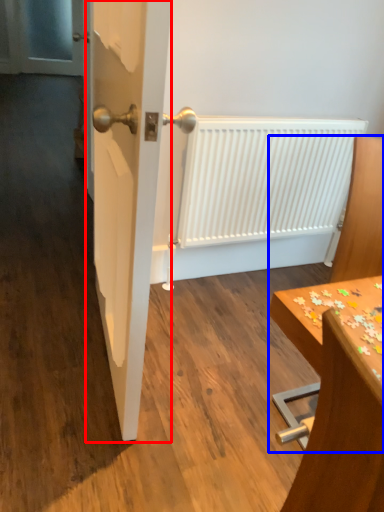
Question: Which point is further to the camera, door (highlighted by a red box) or furniture (highlighted by a blue box)?

Choices:
 (A) door
 (B) furniture

Answer: (B)